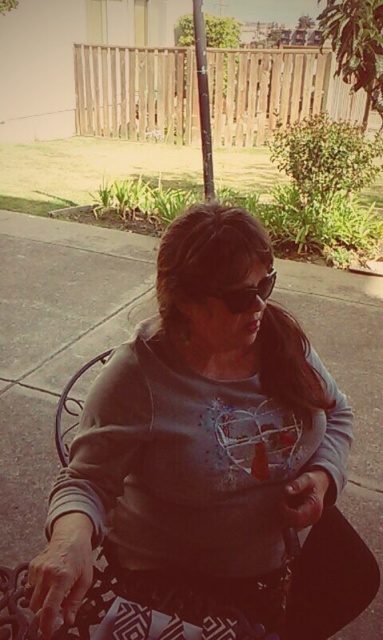
You are a fashion designer observing a person wearing a gray matte sweatshirt at center and matte black goggles at center. Which item is positioned to the right?

The matte black goggles at center are positioned to the right of the gray matte sweatshirt at center.

You are a fashion designer observing a person wearing a gray matte sweatshirt at center and matte black goggles at center. Which clothing item is positioned higher on their body?

The gray matte sweatshirt at center is much taller than the matte black goggles at center, so the sweatshirt is positioned higher on their body.